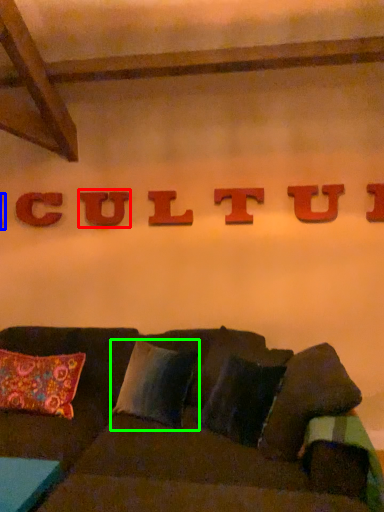
Question: Which is nearer to the letter (highlighted by a red box)? letter (highlighted by a blue box) or pillow (highlighted by a green box).

Choices:
 (A) letter
 (B) pillow

Answer: (A)